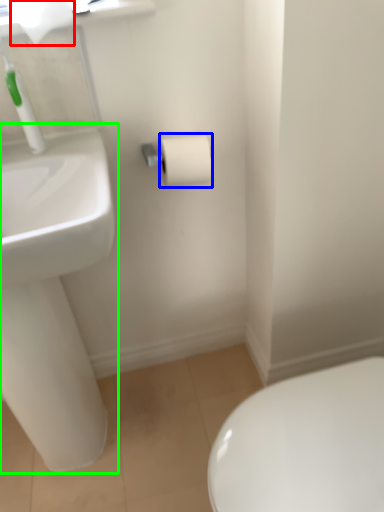
Question: Considering the real-world distances, which object is farthest from toilet paper (highlighted by a red box)? toilet paper (highlighted by a blue box) or sink (highlighted by a green box)?

Choices:
 (A) toilet paper
 (B) sink

Answer: (B)